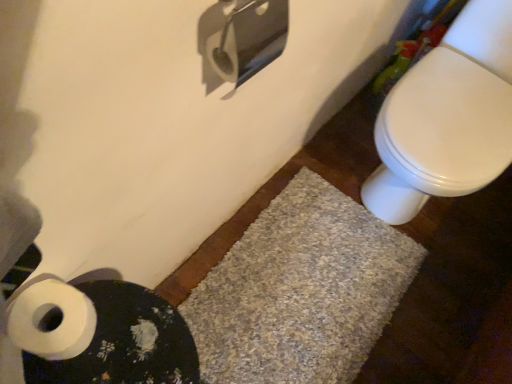
In order to face white glossy toilet at right, should I rotate leftwards or rightwards?

It's best to rotate right around 26.448 degrees.

Describe the element at coordinates (301, 291) in the screenshot. This screenshot has width=512, height=384. I see `gray shaggy bath mat at lower center, which is the 1th bath mat in back-to-front order` at that location.

At what (x,y) coordinates should I click in order to perform the action: click on gray shaggy bath mat at lower center, which appears as the second bath mat when viewed from the front. Please return your answer as a coordinate pair (x, y). Looking at the image, I should click on (301, 291).

The height and width of the screenshot is (384, 512). I want to click on white matte toilet paper at lower left, so click(x=57, y=326).

Considering the sizes of white textured bath mat at lower left, which is the second bath mat in back-to-front order, and white glossy toilet at right in the image, is white textured bath mat at lower left, which is the second bath mat in back-to-front order, bigger or smaller than white glossy toilet at right?

Clearly, white textured bath mat at lower left, which is the second bath mat in back-to-front order, is smaller in size than white glossy toilet at right.

Does white textured bath mat at lower left, the 1th bath mat viewed from the front, turn towards white glossy toilet at right?

No.

From the image's perspective, would you say white textured bath mat at lower left, the 1th bath mat viewed from the front, is positioned over white glossy toilet at right?

Actually, white textured bath mat at lower left, the 1th bath mat viewed from the front, appears below white glossy toilet at right in the image.

How different are the orientations of white textured bath mat at lower left, which is the second bath mat in back-to-front order, and gray shaggy bath mat at lower center, which appears as the second bath mat when viewed from the front, in degrees?

The angular difference between white textured bath mat at lower left, which is the second bath mat in back-to-front order, and gray shaggy bath mat at lower center, which appears as the second bath mat when viewed from the front, is 87.9 degrees.

Looking at this image, is white textured bath mat at lower left, the 1th bath mat viewed from the front, directly adjacent to gray shaggy bath mat at lower center, which is the 1th bath mat in back-to-front order?

white textured bath mat at lower left, the 1th bath mat viewed from the front, is not next to gray shaggy bath mat at lower center, which is the 1th bath mat in back-to-front order, and they're not touching.

Is white textured bath mat at lower left, which is the second bath mat in back-to-front order, at the left side of gray shaggy bath mat at lower center, which is the 1th bath mat in back-to-front order?

Yes.

Considering the sizes of white glossy toilet at right and white matte toilet paper at lower left in the image, is white glossy toilet at right wider or thinner than white matte toilet paper at lower left?

Considering their sizes, white glossy toilet at right looks broader than white matte toilet paper at lower left.

Is white glossy toilet at right not near white matte toilet paper at lower left?

Actually, white glossy toilet at right and white matte toilet paper at lower left are a little close together.

Does white glossy toilet at right contain white matte toilet paper at lower left?

No, white matte toilet paper at lower left is not surrounded by white glossy toilet at right.

How much distance is there between white glossy toilet at right and white matte toilet paper at lower left?

They are 38.22 inches apart.

From the image's perspective, is gray shaggy bath mat at lower center, which appears as the second bath mat when viewed from the front, located above white matte toilet paper at lower left?

No, from the image's perspective, gray shaggy bath mat at lower center, which appears as the second bath mat when viewed from the front, is not on top of white matte toilet paper at lower left.

Relative to white matte toilet paper at lower left, is gray shaggy bath mat at lower center, which is the 1th bath mat in back-to-front order, in front or behind?

Visually, gray shaggy bath mat at lower center, which is the 1th bath mat in back-to-front order, is located behind white matte toilet paper at lower left.

Between gray shaggy bath mat at lower center, which appears as the second bath mat when viewed from the front, and white matte toilet paper at lower left, which one has smaller size?

With smaller size is white matte toilet paper at lower left.

Considering the sizes of objects gray shaggy bath mat at lower center, which is the 1th bath mat in back-to-front order, and white matte toilet paper at lower left in the image provided, who is shorter, gray shaggy bath mat at lower center, which is the 1th bath mat in back-to-front order, or white matte toilet paper at lower left?

gray shaggy bath mat at lower center, which is the 1th bath mat in back-to-front order.

Considering the relative sizes of white matte toilet paper at lower left and white textured bath mat at lower left, which is the second bath mat in back-to-front order, in the image provided, is white matte toilet paper at lower left wider than white textured bath mat at lower left, which is the second bath mat in back-to-front order,?

No, white matte toilet paper at lower left is not wider than white textured bath mat at lower left, which is the second bath mat in back-to-front order.

Who is bigger, white matte toilet paper at lower left or white textured bath mat at lower left, the 1th bath mat viewed from the front?

white textured bath mat at lower left, the 1th bath mat viewed from the front, is bigger.

From the picture: Is white matte toilet paper at lower left to the right of white textured bath mat at lower left, the 1th bath mat viewed from the front, from the viewer's perspective?

Incorrect, white matte toilet paper at lower left is not on the right side of white textured bath mat at lower left, the 1th bath mat viewed from the front.

How many degrees apart are the facing directions of white matte toilet paper at lower left and white glossy toilet at right?

88.7 degrees separate the facing orientations of white matte toilet paper at lower left and white glossy toilet at right.

Is white matte toilet paper at lower left surrounding white glossy toilet at right?

No, white glossy toilet at right is not a part of white matte toilet paper at lower left.

Can you confirm if white matte toilet paper at lower left is positioned to the right of white glossy toilet at right?

No.

Is white matte toilet paper at lower left oriented towards white glossy toilet at right?

No, white matte toilet paper at lower left is not turned towards white glossy toilet at right.

Which is correct: white glossy toilet at right is inside white textured bath mat at lower left, the 1th bath mat viewed from the front, or outside of it?

white glossy toilet at right is not inside white textured bath mat at lower left, the 1th bath mat viewed from the front, it's outside.

Is white glossy toilet at right far from white textured bath mat at lower left, which is the second bath mat in back-to-front order?

No.

Is white glossy toilet at right to the left of white textured bath mat at lower left, the 1th bath mat viewed from the front, from the viewer's perspective?

No, white glossy toilet at right is not to the left of white textured bath mat at lower left, the 1th bath mat viewed from the front.

From a real-world perspective, count 1st bath mats downward from the white glossy toilet at right and point to it. Please provide its 2D coordinates.

[(125, 342)]

Find the location of a particular element. The height and width of the screenshot is (384, 512). bath mat that appears on the left of gray shaggy bath mat at lower center, which appears as the second bath mat when viewed from the front is located at coordinates click(x=125, y=342).

Estimate the real-world distances between objects in this image. Which object is closer to white matte toilet paper at lower left, white textured bath mat at lower left, the 1th bath mat viewed from the front, or white glossy toilet at right?

white textured bath mat at lower left, the 1th bath mat viewed from the front.

Based on their spatial positions, is white textured bath mat at lower left, which is the second bath mat in back-to-front order, or white glossy toilet at right closer to gray shaggy bath mat at lower center, which appears as the second bath mat when viewed from the front?

white glossy toilet at right is positioned closer to the anchor gray shaggy bath mat at lower center, which appears as the second bath mat when viewed from the front.

When comparing their distances from white glossy toilet at right, does gray shaggy bath mat at lower center, which appears as the second bath mat when viewed from the front, or white textured bath mat at lower left, the 1th bath mat viewed from the front, seem closer?

Based on the image, gray shaggy bath mat at lower center, which appears as the second bath mat when viewed from the front, appears to be nearer to white glossy toilet at right.

Based on their spatial positions, is white glossy toilet at right or white textured bath mat at lower left, which is the second bath mat in back-to-front order, further from white matte toilet paper at lower left?

The object further to white matte toilet paper at lower left is white glossy toilet at right.

From the image, which object appears to be farther from gray shaggy bath mat at lower center, which is the 1th bath mat in back-to-front order, white glossy toilet at right or white matte toilet paper at lower left?

white matte toilet paper at lower left lies further to gray shaggy bath mat at lower center, which is the 1th bath mat in back-to-front order, than the other object.

Estimate the real-world distances between objects in this image. Which object is further from white textured bath mat at lower left, the 1th bath mat viewed from the front, white glossy toilet at right or white matte toilet paper at lower left?

white glossy toilet at right lies further to white textured bath mat at lower left, the 1th bath mat viewed from the front, than the other object.

Which object lies further to the anchor point white matte toilet paper at lower left, white textured bath mat at lower left, which is the second bath mat in back-to-front order, or gray shaggy bath mat at lower center, which is the 1th bath mat in back-to-front order?

gray shaggy bath mat at lower center, which is the 1th bath mat in back-to-front order.

Based on their spatial positions, is white matte toilet paper at lower left or white textured bath mat at lower left, the 1th bath mat viewed from the front, further from gray shaggy bath mat at lower center, which is the 1th bath mat in back-to-front order?

white matte toilet paper at lower left is positioned further to the anchor gray shaggy bath mat at lower center, which is the 1th bath mat in back-to-front order.

The width and height of the screenshot is (512, 384). Identify the location of bath mat situated between white textured bath mat at lower left, which is the second bath mat in back-to-front order, and white glossy toilet at right from left to right. (301, 291).

You are a GUI agent. You are given a task and a screenshot of the screen. Output one action in this format:
    pyautogui.click(x=<x>, y=<y>)
    Task: Click on the bath mat between white matte toilet paper at lower left and gray shaggy bath mat at lower center, which is the 1th bath mat in back-to-front order
    
    Given the screenshot: What is the action you would take?
    pyautogui.click(x=125, y=342)